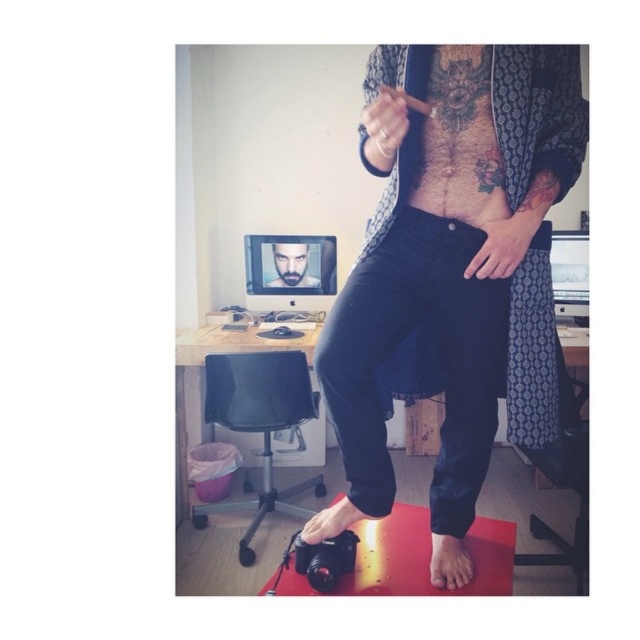
Does smooth skin foot at lower center have a larger size compared to smooth skin face at center?

Actually, smooth skin foot at lower center might be smaller than smooth skin face at center.

Does smooth skin foot at lower center have a lesser width compared to smooth skin face at center?

Yes.

Which is behind, point (460, 554) or point (276, 244)?

Positioned behind is point (276, 244).

Where is `smooth skin foot at lower center`? The width and height of the screenshot is (640, 640). smooth skin foot at lower center is located at coordinates coord(449,563).

Does smooth skin foot at lower center appear on the right side of matte black foot at lower center?

Indeed, smooth skin foot at lower center is positioned on the right side of matte black foot at lower center.

Is smooth skin foot at lower center thinner than matte black foot at lower center?

Correct, smooth skin foot at lower center's width is less than matte black foot at lower center's.

At what (x,y) coordinates should I click in order to perform the action: click on smooth skin foot at lower center. Please return your answer as a coordinate pair (x, y). Looking at the image, I should click on (449, 563).

Does matte black jeans at center have a smaller size compared to matte black foot at lower center?

No, matte black jeans at center is not smaller than matte black foot at lower center.

Is the position of matte black jeans at center less distant than that of matte black foot at lower center?

Yes, matte black jeans at center is in front of matte black foot at lower center.

Who is more forward, (372, 317) or (321, 529)?

Point (372, 317) is in front.

What are the coordinates of `matte black jeans at center` in the screenshot? It's located at (454, 262).